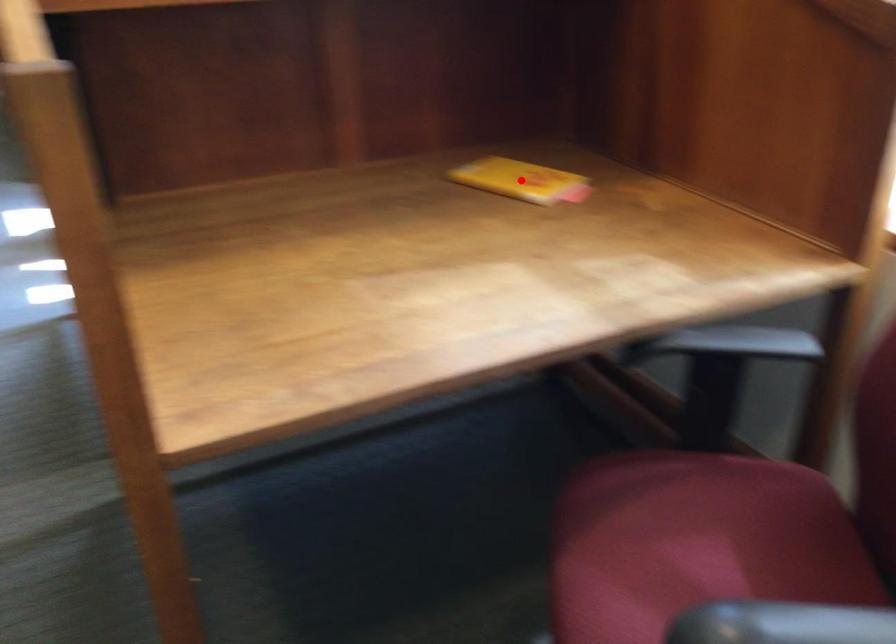
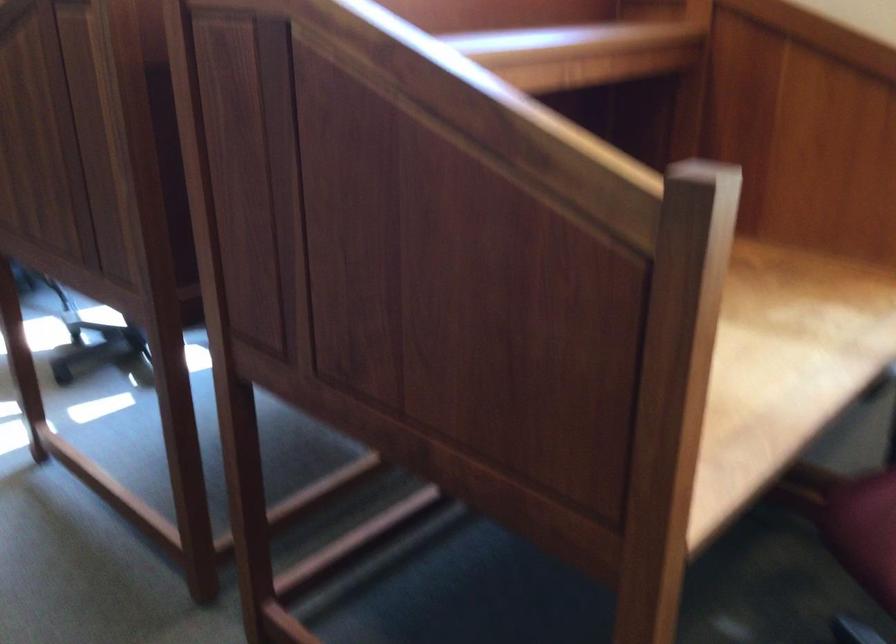
Question: I am providing you with two images of the same scene from different viewpoints. A red point is marked on the first image. At the location where the point appears in image 1, is it still visible in image 2?

Choices:
 (A) Yes
 (B) No

Answer: (B)